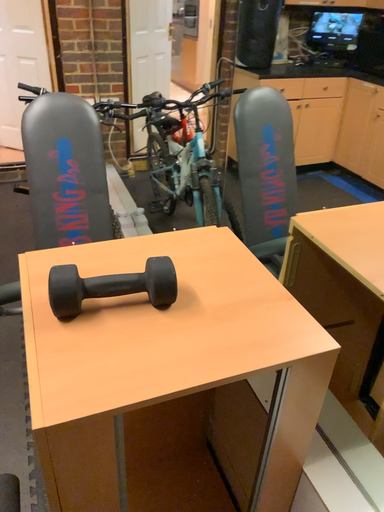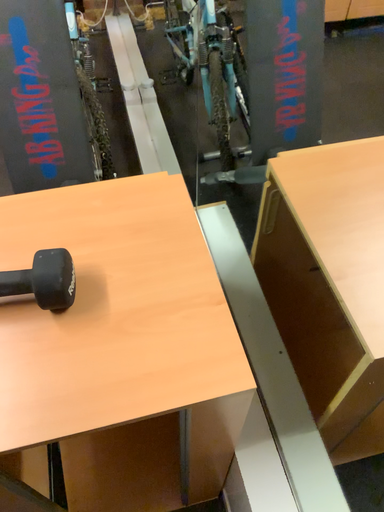
Question: How did the camera likely rotate when shooting the video?

Choices:
 (A) rotated upward
 (B) rotated downward

Answer: (B)